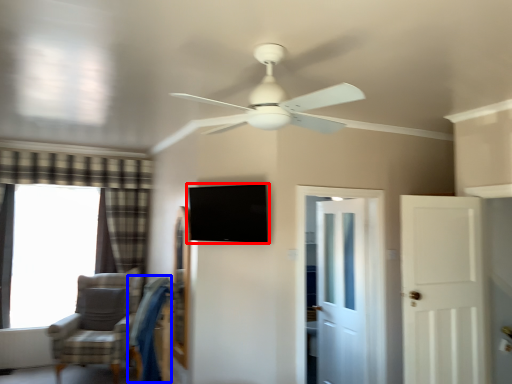
Question: Which point is closer to the camera, window screen (highlighted by a red box) or swivel chair (highlighted by a blue box)?

Choices:
 (A) window screen
 (B) swivel chair

Answer: (A)